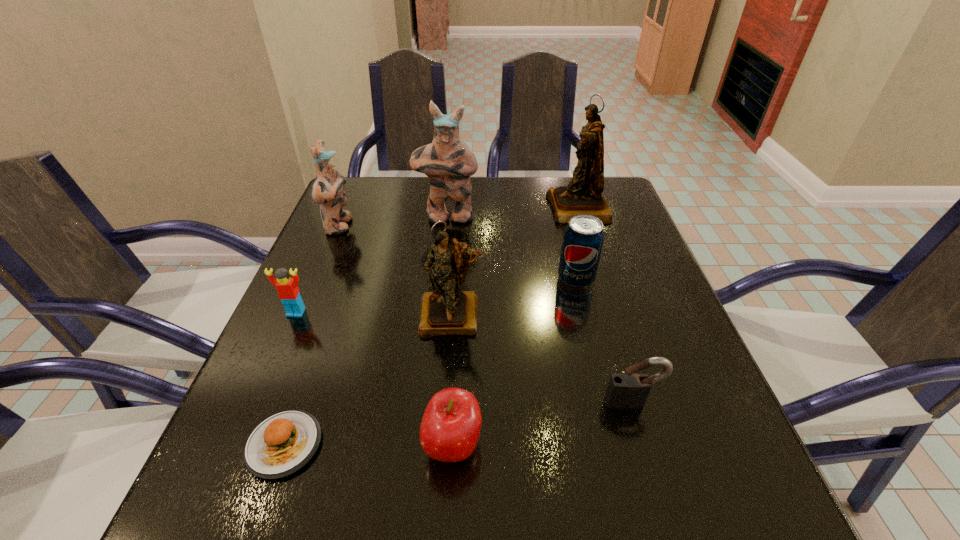
You are a GUI agent. You are given a task and a screenshot of the screen. Output one action in this format:
    pyautogui.click(x=<x>, y=<y>)
    Task: Click on the apple
    This screenshot has height=540, width=960.
    Given the screenshot: What is the action you would take?
    pyautogui.click(x=451, y=424)

Where is `the seventh farthest object`? The image size is (960, 540). the seventh farthest object is located at coordinates [x=629, y=390].

Identify the location of the shortest object. (283, 443).

Image resolution: width=960 pixels, height=540 pixels. I want to click on free space located on the front-facing side of the right gold figurine, so 530,209.

At what (x,y) coordinates should I click in order to perform the action: click on vacant position located on the front-facing side of the right gold figurine. Please return your answer as a coordinate pair (x, y). The image size is (960, 540). Looking at the image, I should click on (405, 209).

Where is `vacant space located on the front-facing side of the right gold figurine`? Image resolution: width=960 pixels, height=540 pixels. vacant space located on the front-facing side of the right gold figurine is located at coordinates (464, 209).

In order to click on blank space located on the front-facing side of the bigger pink figurine in this screenshot , I will do `click(440, 293)`.

Identify the location of free location located 0.110m on the front-facing side of the leftmost figurine. The height and width of the screenshot is (540, 960). (396, 226).

Where is `free spot located on the front-facing side of the left gold figurine`? Image resolution: width=960 pixels, height=540 pixels. free spot located on the front-facing side of the left gold figurine is located at coordinates (447, 382).

Image resolution: width=960 pixels, height=540 pixels. In order to click on free space located 0.090m on the front of the sixth nearest object in this screenshot , I will do pyautogui.click(x=587, y=322).